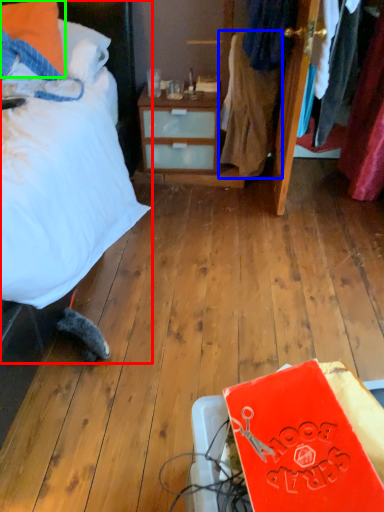
Question: Which object is positioned closest to bed (highlighted by a red box)? Select from clothing (highlighted by a blue box) and pillow (highlighted by a green box).

Choices:
 (A) clothing
 (B) pillow

Answer: (B)